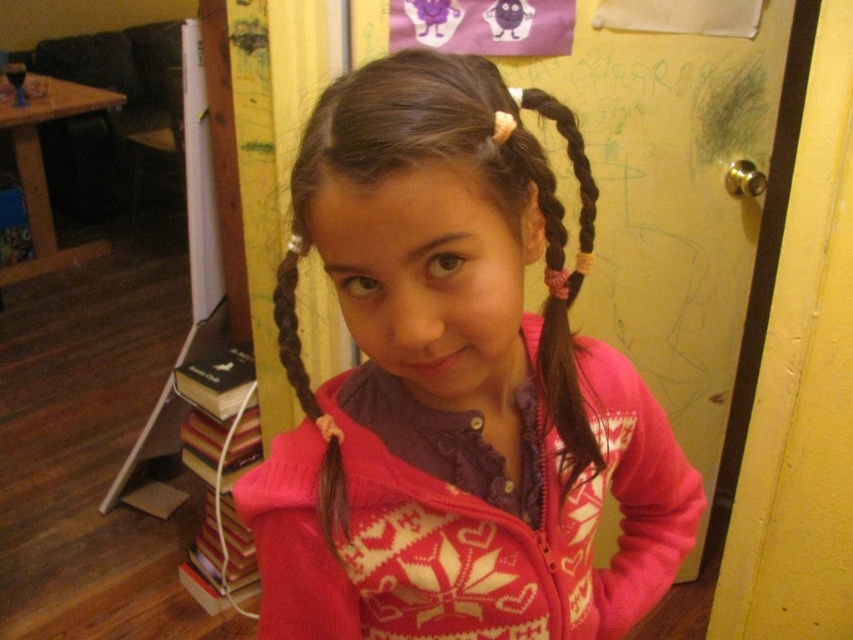
Who is positioned more to the right, brown silky hair at center or brown braided hair at left?

brown silky hair at center is more to the right.

Is brown silky hair at center shorter than brown braided hair at left?

In fact, brown silky hair at center may be taller than brown braided hair at left.

Locate an element on the screen. brown silky hair at center is located at coordinates (561, 284).

Locate an element on the screen. brown silky hair at center is located at coordinates (561, 284).

Measure the distance between pink sweater at center and camera.

pink sweater at center is 14.53 inches from camera.

Between point (287, 596) and point (299, 378), which one is positioned in front?

Positioned in front is point (299, 378).

Locate an element on the screen. The image size is (853, 640). pink sweater at center is located at coordinates (454, 387).

The image size is (853, 640). I want to click on pink sweater at center, so click(x=454, y=387).

Is pink sweater at center below brown silky hair at center?

Yes.

Which is more to the right, pink sweater at center or brown silky hair at center?

brown silky hair at center

At what (x,y) coordinates should I click in order to perform the action: click on pink sweater at center. Please return your answer as a coordinate pair (x, y). The image size is (853, 640). Looking at the image, I should click on (454, 387).

The height and width of the screenshot is (640, 853). I want to click on pink sweater at center, so click(x=454, y=387).